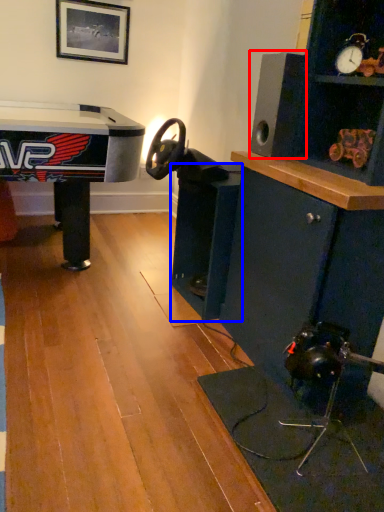
Question: Which of the following is the farthest to the observer, speaker (highlighted by a red box) or shelf (highlighted by a blue box)?

Choices:
 (A) speaker
 (B) shelf

Answer: (B)